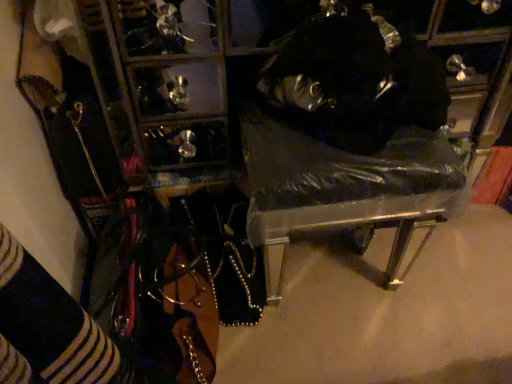
Where is `unoccupied area in front of clear plastic bag at center`? The height and width of the screenshot is (384, 512). unoccupied area in front of clear plastic bag at center is located at coordinates (350, 351).